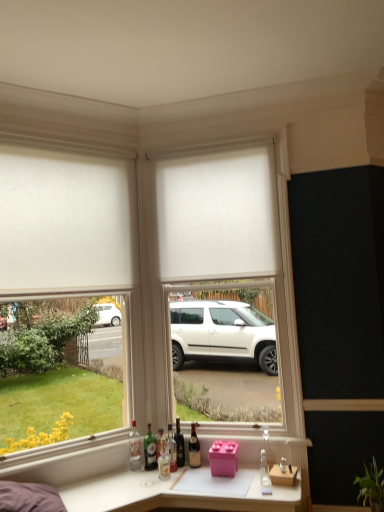
This screenshot has width=384, height=512. In order to click on free space to the left of green glass bottle at lower center, which appears as the second bottle when viewed from the left in this screenshot , I will do `click(123, 472)`.